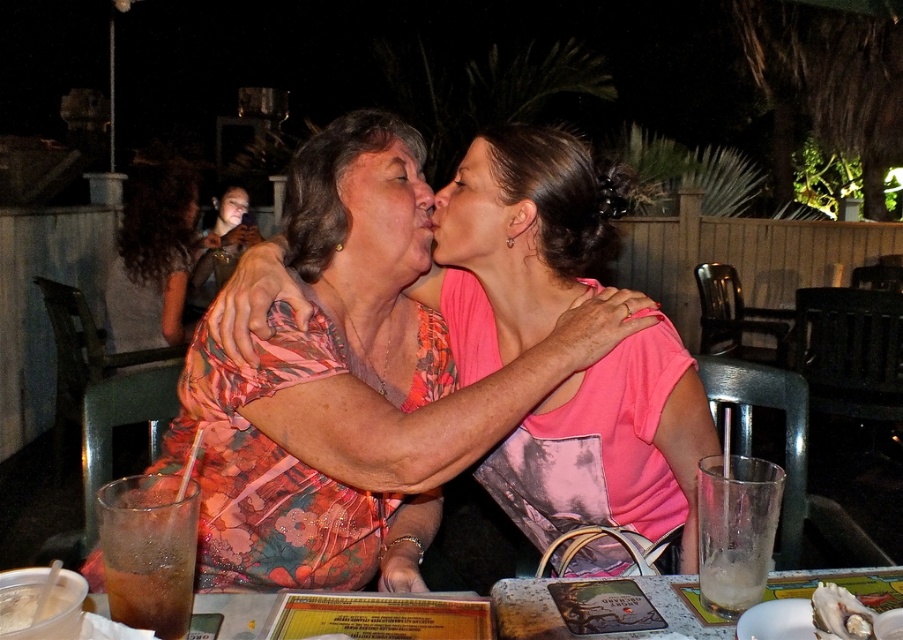
Can you confirm if floral fabric dress at center is positioned to the right of floral fabric blouse at upper left?

Indeed, floral fabric dress at center is positioned on the right side of floral fabric blouse at upper left.

Is point (389, 113) positioned in front of point (166, 269)?

Yes, point (389, 113) is closer to viewer.

You are a GUI agent. You are given a task and a screenshot of the screen. Output one action in this format:
    pyautogui.click(x=<x>, y=<y>)
    Task: Click on the floral fabric dress at center
    This screenshot has width=903, height=640.
    Given the screenshot: What is the action you would take?
    pyautogui.click(x=349, y=401)

Is point (406, 256) positioned in front of point (235, 196)?

Yes, it is.

Is point (405, 272) behind point (231, 202)?

No.

The width and height of the screenshot is (903, 640). I want to click on matte floral shirt at center, so click(x=385, y=216).

Is the position of pink matte shirt at center more distant than that of smooth skin face at center?

No, it is in front of smooth skin face at center.

Is pink matte shirt at center closer to the viewer compared to smooth skin face at center?

Yes, pink matte shirt at center is closer to the viewer.

Does point (485, 216) come closer to viewer compared to point (229, 208)?

Yes, it is.

Identify the location of pink matte shirt at center. The height and width of the screenshot is (640, 903). (475, 214).